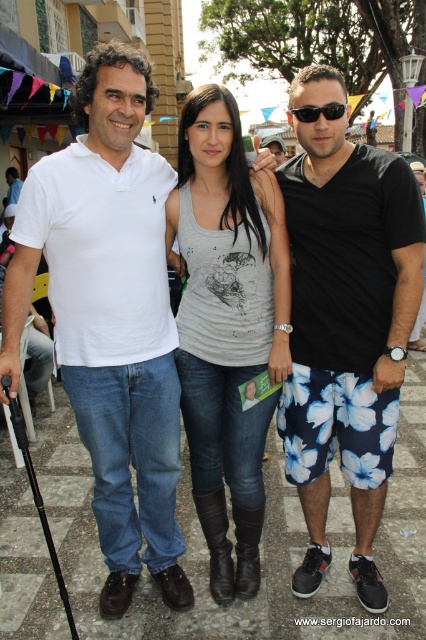
You are a photographer trying to capture a detailed shot of the black cotton shorts at right and the black plastic sunglasses at center. Which object should you focus on first to ensure it appears sharp in the photo?

The black cotton shorts at right should be focused on first because it is closer to the viewer than the black plastic sunglasses at center, so focusing on the closer object ensures sharpness.

You are a photographer trying to capture a group shot of the black cotton shorts at right and the gray cotton tank top at center. Since you want to highlight both subjects equally, which clothing item should you adjust the camera focus on to ensure they both appear balanced in the frame?

The gray cotton tank top at center should be the focus since it occupies more space than the black cotton shorts at right, balancing their visual weight in the photograph.

You are a photographer trying to capture a group photo. You notice the black cotton shorts at right and the black plastic sunglasses at center. Which object would appear larger in the photo?

The black cotton shorts at right would appear larger in the photo because they are much taller than the black plastic sunglasses at center.